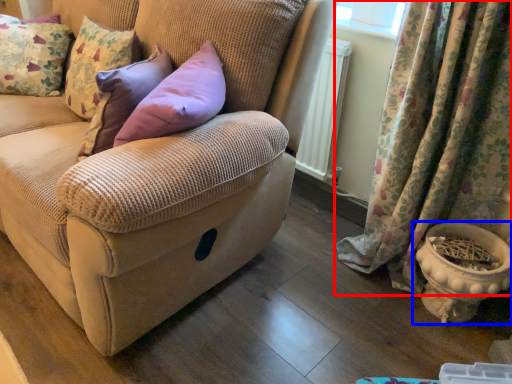
Question: Among these objects, which one is nearest to the camera, curtain (highlighted by a red box) or flowerpot (highlighted by a blue box)?

Choices:
 (A) curtain
 (B) flowerpot

Answer: (A)